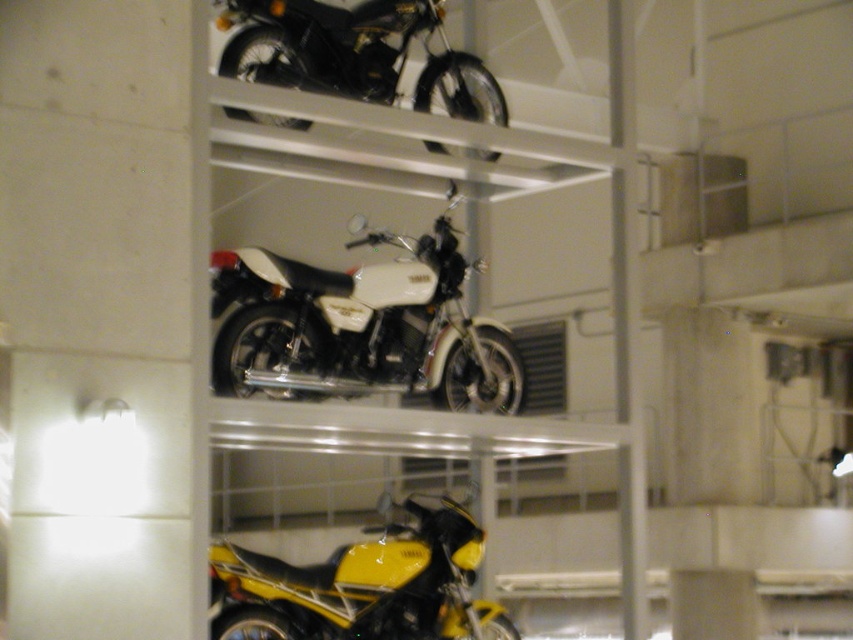
Question: Which point is farther to the camera?

Choices:
 (A) (349, 376)
 (B) (312, 616)
 (C) (283, 77)

Answer: (C)

Question: Is white matte motorcycle at center bigger than shiny black motorcycle at upper center?

Choices:
 (A) yes
 (B) no

Answer: (A)

Question: Among these points, which one is nearest to the camera?

Choices:
 (A) (415, 244)
 (B) (370, 12)

Answer: (B)

Question: Considering the relative positions of yellow glossy motorcycle at lower center and shiny black motorcycle at upper center in the image provided, where is yellow glossy motorcycle at lower center located with respect to shiny black motorcycle at upper center?

Choices:
 (A) right
 (B) left

Answer: (B)

Question: Which of the following is the closest to the observer?

Choices:
 (A) (438, 397)
 (B) (235, 1)

Answer: (B)

Question: Is white matte motorcycle at center to the left of shiny black motorcycle at upper center from the viewer's perspective?

Choices:
 (A) no
 (B) yes

Answer: (B)